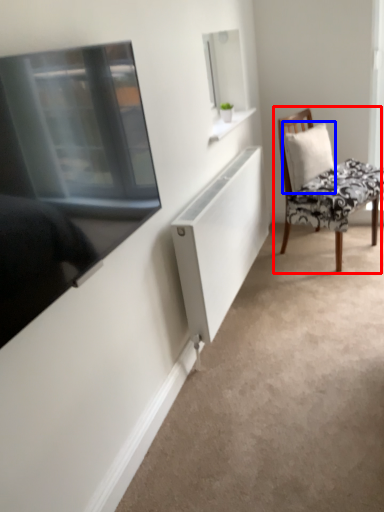
Question: Which of the following is the closest to the observer, chair (highlighted by a red box) or pillow (highlighted by a blue box)?

Choices:
 (A) chair
 (B) pillow

Answer: (A)